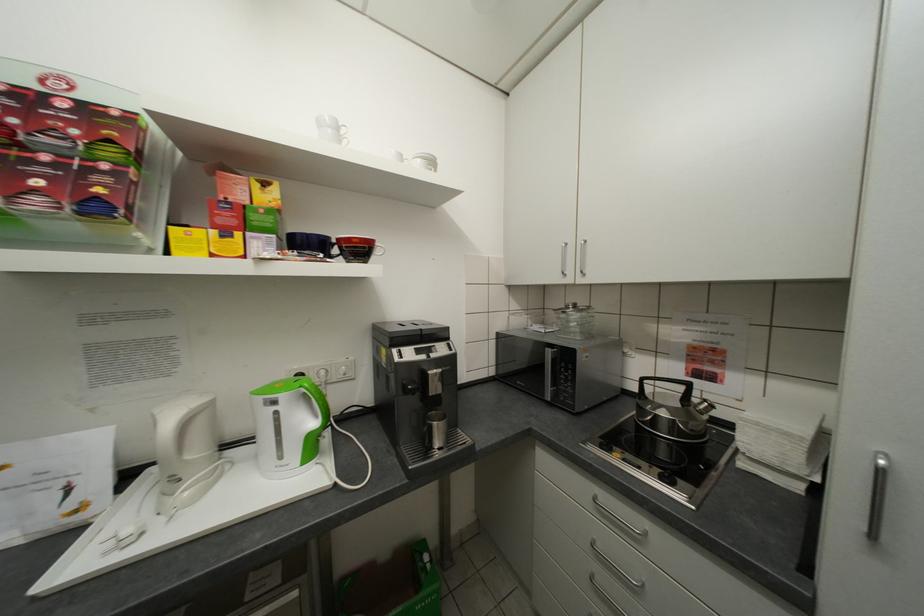
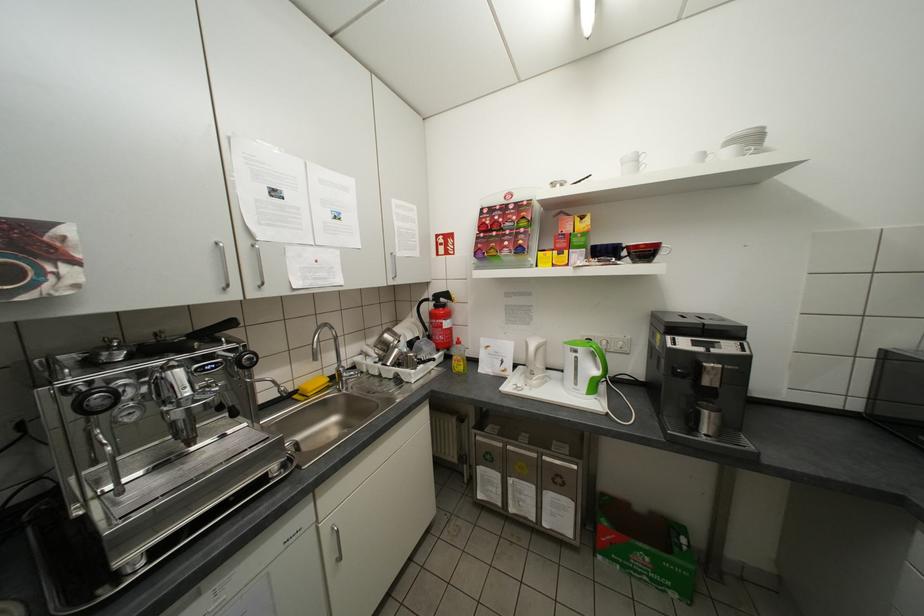
Where in the second image is the point corresponding to (274,405) from the first image?

(579, 351)